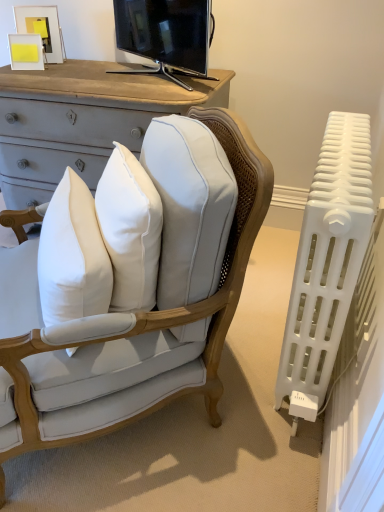
Question: From the image's perspective, does matte white picture frame at upper left, the 1th picture frame positioned from the top, appear lower than white plastic radiator at right?

Choices:
 (A) no
 (B) yes

Answer: (A)

Question: From the image's perspective, is matte white picture frame at upper left, the second picture frame positioned from the bottom, over white plastic radiator at right?

Choices:
 (A) no
 (B) yes

Answer: (B)

Question: Can you confirm if matte white picture frame at upper left, the second picture frame positioned from the bottom, is smaller than white plastic radiator at right?

Choices:
 (A) no
 (B) yes

Answer: (B)

Question: Is matte white picture frame at upper left, the second picture frame positioned from the bottom, not inside white plastic radiator at right?

Choices:
 (A) yes
 (B) no

Answer: (A)

Question: Does matte white picture frame at upper left, the second picture frame positioned from the bottom, come in front of white plastic radiator at right?

Choices:
 (A) no
 (B) yes

Answer: (A)

Question: Is white plastic radiator at right to the left or to the right of white cotton pillow at center in the image?

Choices:
 (A) left
 (B) right

Answer: (B)

Question: Do you think white plastic radiator at right is within white cotton pillow at center, or outside of it?

Choices:
 (A) outside
 (B) inside

Answer: (A)

Question: Looking at the image, does white plastic radiator at right seem bigger or smaller compared to white cotton pillow at center?

Choices:
 (A) big
 (B) small

Answer: (A)

Question: Considering the positions of point (291, 335) and point (64, 197), is point (291, 335) closer or farther from the camera than point (64, 197)?

Choices:
 (A) closer
 (B) farther

Answer: (A)

Question: Considering the positions of white fabric chair at center and matte white picture frame at upper left, the second picture frame positioned from the bottom, in the image, is white fabric chair at center wider or thinner than matte white picture frame at upper left, the second picture frame positioned from the bottom,?

Choices:
 (A) thin
 (B) wide

Answer: (B)

Question: In terms of size, does white fabric chair at center appear bigger or smaller than matte white picture frame at upper left, the 1th picture frame positioned from the top?

Choices:
 (A) small
 (B) big

Answer: (B)

Question: Is white fabric chair at center situated inside matte white picture frame at upper left, the 1th picture frame positioned from the top, or outside?

Choices:
 (A) inside
 (B) outside

Answer: (B)

Question: From a real-world perspective, is white fabric chair at center above or below matte white picture frame at upper left, the 1th picture frame positioned from the top?

Choices:
 (A) above
 (B) below

Answer: (B)

Question: Considering the positions of point (110, 412) and point (140, 48), is point (110, 412) closer or farther from the camera than point (140, 48)?

Choices:
 (A) closer
 (B) farther

Answer: (A)

Question: From a real-world perspective, is white fabric chair at center physically located above or below black glossy tv at upper center?

Choices:
 (A) above
 (B) below

Answer: (B)